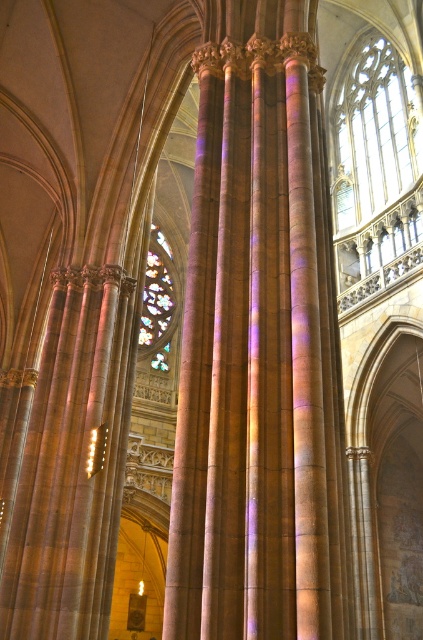
Who is positioned more to the left, stained glass window at center or metallic gold light at center?

stained glass window at center is more to the left.

Which of these two, stained glass window at center or metallic gold light at center, stands shorter?

metallic gold light at center

At what (x,y) coordinates should I click in order to perform the action: click on stained glass window at center. Please return your answer as a coordinate pair (x, y). This screenshot has height=640, width=423. Looking at the image, I should click on (158, 301).

Between point (343, 148) and point (161, 296), which one is positioned behind?

The point (161, 296) is more distant.

In the scene shown: Who is taller, clear glass window at upper right or stained glass window at center?

clear glass window at upper right

The image size is (423, 640). Identify the location of clear glass window at upper right. tap(375, 134).

I want to click on clear glass window at upper right, so click(375, 134).

Who is shorter, clear glass window at upper right or metallic gold light at center?

With less height is metallic gold light at center.

From the picture: Which of these two, clear glass window at upper right or metallic gold light at center, stands taller?

With more height is clear glass window at upper right.

Where is `clear glass window at upper right`? Image resolution: width=423 pixels, height=640 pixels. clear glass window at upper right is located at coordinates (375, 134).

Image resolution: width=423 pixels, height=640 pixels. Identify the location of clear glass window at upper right. [375, 134].